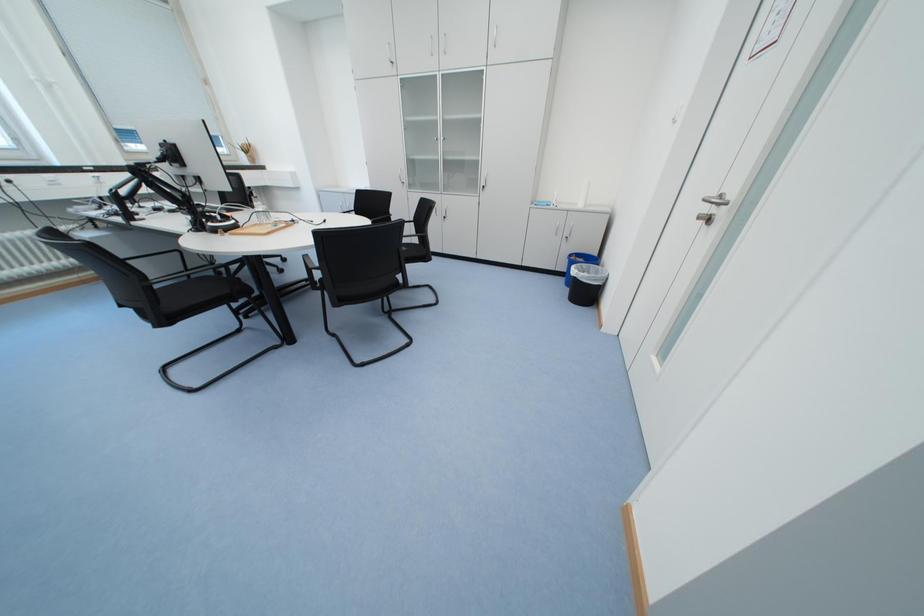
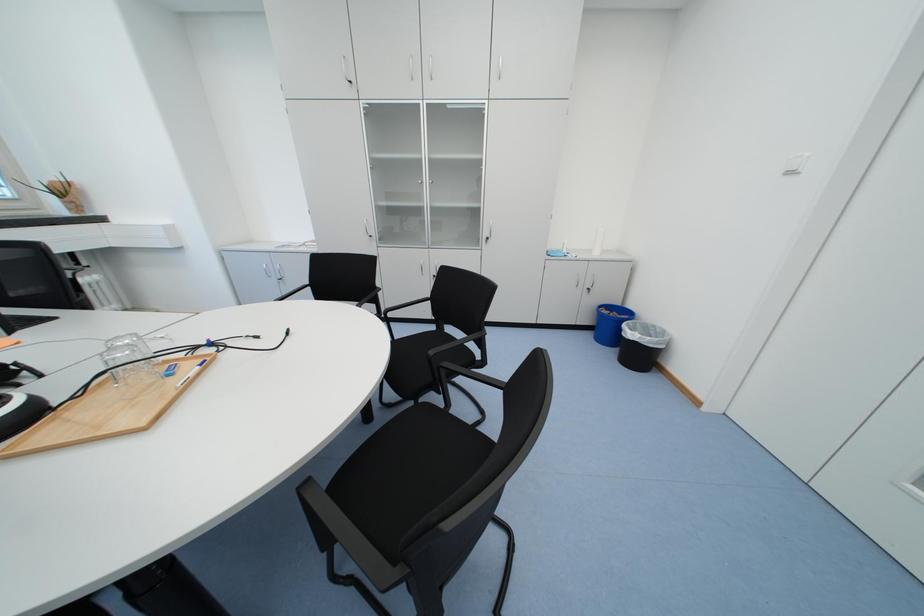
In a continuous first-person perspective shot, in which direction is the camera moving?

The cameraman walked toward left, forward.